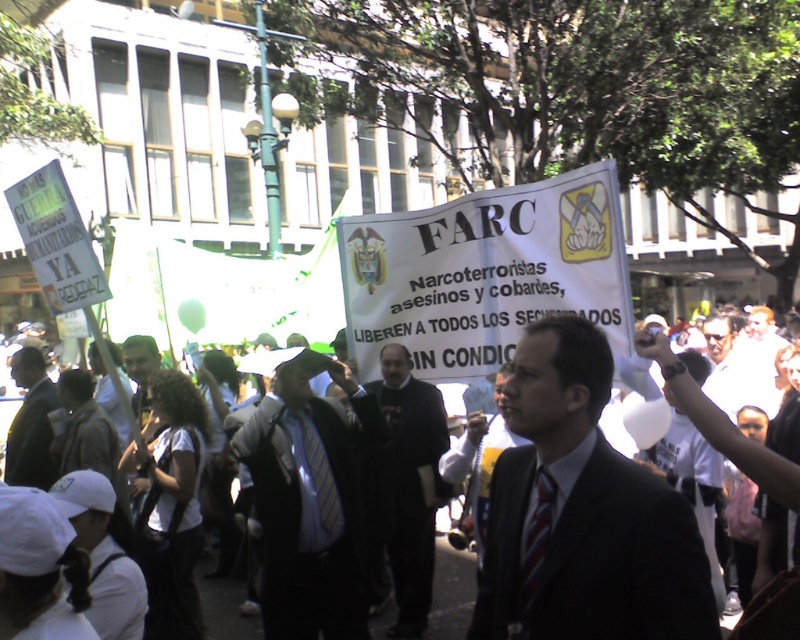
Question: Can you confirm if black matte suit at center is positioned above white paper banner at center?

Choices:
 (A) yes
 (B) no

Answer: (A)

Question: Is dark suit at center positioned at the back of light blue striped tie at center?

Choices:
 (A) yes
 (B) no

Answer: (B)

Question: Which of the following is the closest to the observer?

Choices:
 (A) (x=24, y=388)
 (B) (x=412, y=490)
 (C) (x=490, y=497)
 (D) (x=277, y=579)

Answer: (C)

Question: Which point appears farthest from the camera in this image?

Choices:
 (A) (284, 369)
 (B) (536, 564)
 (C) (454, 557)

Answer: (C)

Question: Does black matte suit at center have a smaller size compared to white paper banner at center?

Choices:
 (A) yes
 (B) no

Answer: (B)

Question: Which point is closer to the camera?

Choices:
 (A) (17, 364)
 (B) (486, 580)

Answer: (B)